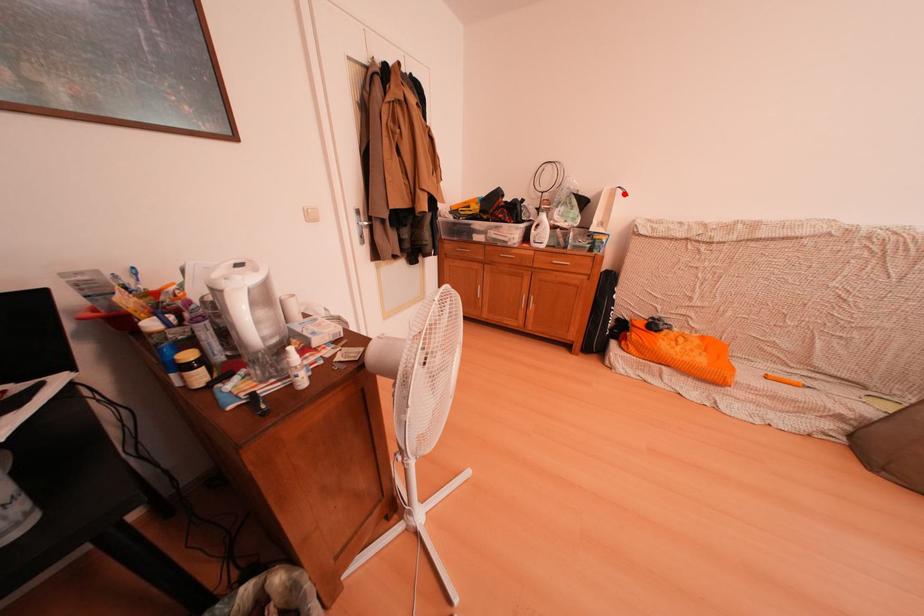
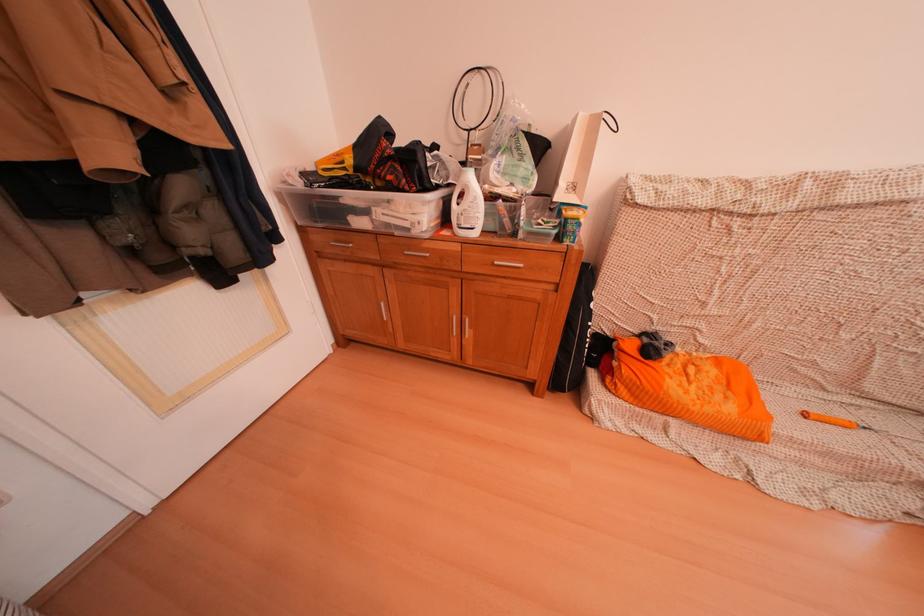
The point at the highlighted location is marked in the first image. Where is the corresponding point in the second image?

(603, 121)